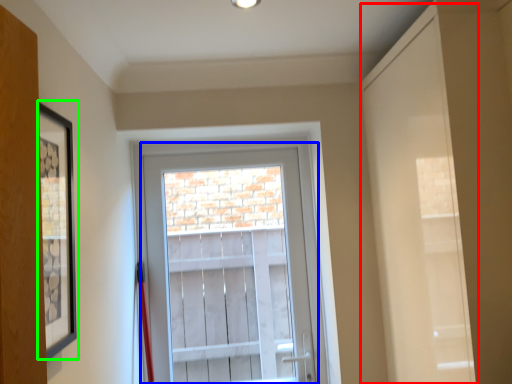
Question: Which object is the farthest from door (highlighted by a red box)? Choose among these: glass door (highlighted by a blue box) or picture frame (highlighted by a green box).

Choices:
 (A) glass door
 (B) picture frame

Answer: (A)